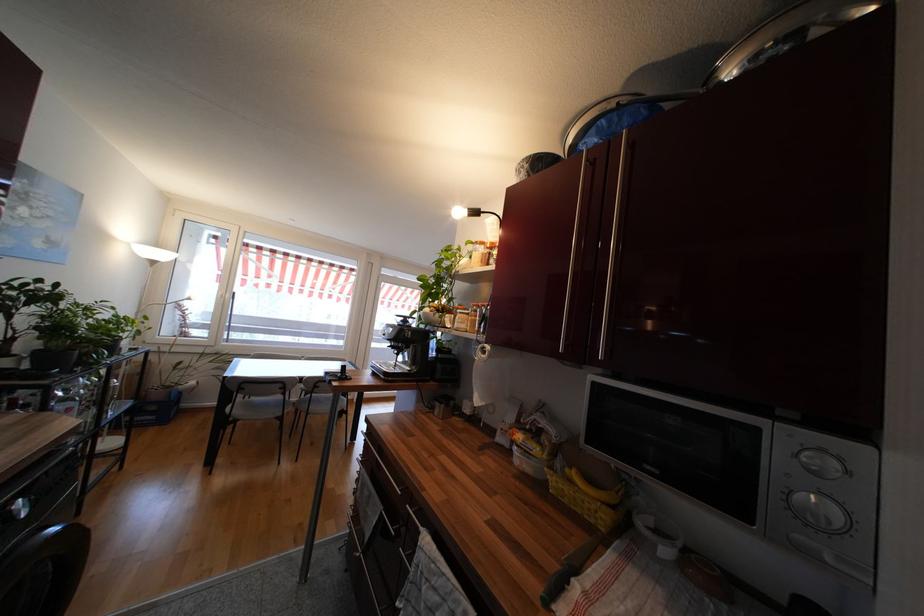
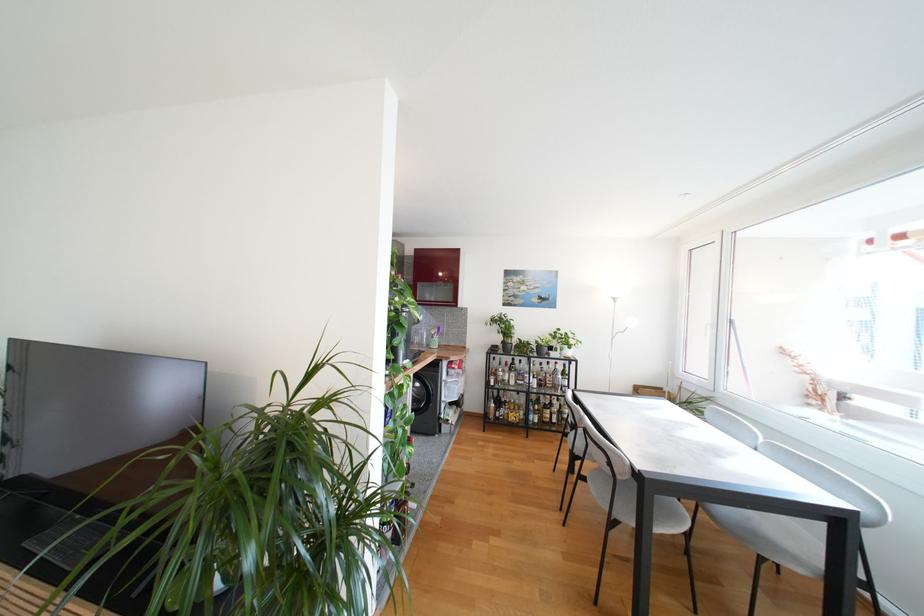
Question: I am providing you with two images of the same scene from different viewpoints. Which of the following objects are not visible in image2?

Choices:
 (A) blue plastic crate
 (B) green hanging bag
 (C) grey chair sitting surface
 (D) glass bottle

Answer: (A)